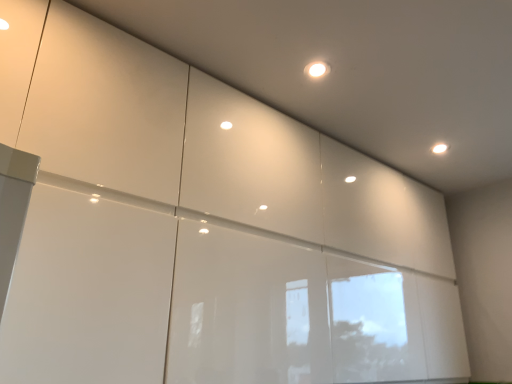
What do you see at coordinates (439, 148) in the screenshot? Image resolution: width=512 pixels, height=384 pixels. I see `white glossy light at upper right` at bounding box center [439, 148].

You are a GUI agent. You are given a task and a screenshot of the screen. Output one action in this format:
    pyautogui.click(x=<x>, y=<y>)
    Task: Click on the white glossy light at upper right
    The image size is (512, 384).
    Given the screenshot: What is the action you would take?
    pyautogui.click(x=439, y=148)

Where is `white glossy light at upper right`? This screenshot has height=384, width=512. white glossy light at upper right is located at coordinates (439, 148).